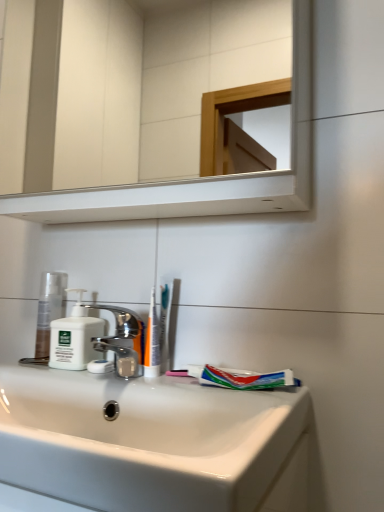
You are a GUI agent. You are given a task and a screenshot of the screen. Output one action in this format:
    pyautogui.click(x=<x>, y=<y>)
    Task: Click on the vacant position to the left of white plastic toothbrush at center
    The height and width of the screenshot is (512, 384).
    Given the screenshot: What is the action you would take?
    pyautogui.click(x=80, y=373)